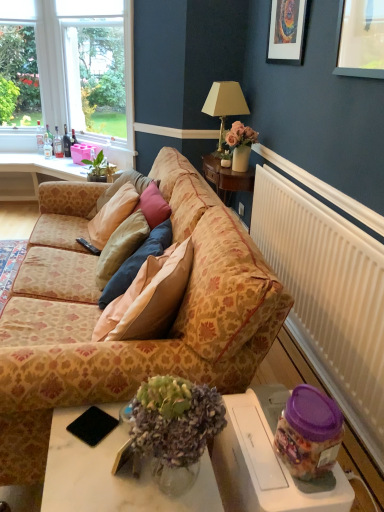
Question: Relative to clear glass bottle at left, the 3th bottle when ordered from right to left, is purple plastic jar at lower right in front or behind?

Choices:
 (A) behind
 (B) front

Answer: (B)

Question: Looking at the image, does purple plastic jar at lower right seem bigger or smaller compared to clear glass bottle at left, the 3th bottle when ordered from right to left?

Choices:
 (A) big
 (B) small

Answer: (A)

Question: Based on their relative distances, which object is nearer to the clear glass bottle at upper left, the 4th bottle viewed from the right?

Choices:
 (A) black matte pad at lower left
 (B) white marble table at lower center
 (C) beige fabric lampshade at upper right
 (D) black plastic remote control at center
 (E) clear glass bottle at left, the 3th bottle when ordered from right to left

Answer: (E)

Question: Which object is the closest to the black plastic remote control at center?

Choices:
 (A) white glossy desk at upper left
 (B) green leafy plant at upper left
 (C) clear glass bottle at left, acting as the 2th bottle starting from the right
 (D) matte glass bottle at center, placed as the 4th bottle when sorted from left to right
 (E) matte black picture frame at upper center

Answer: (B)